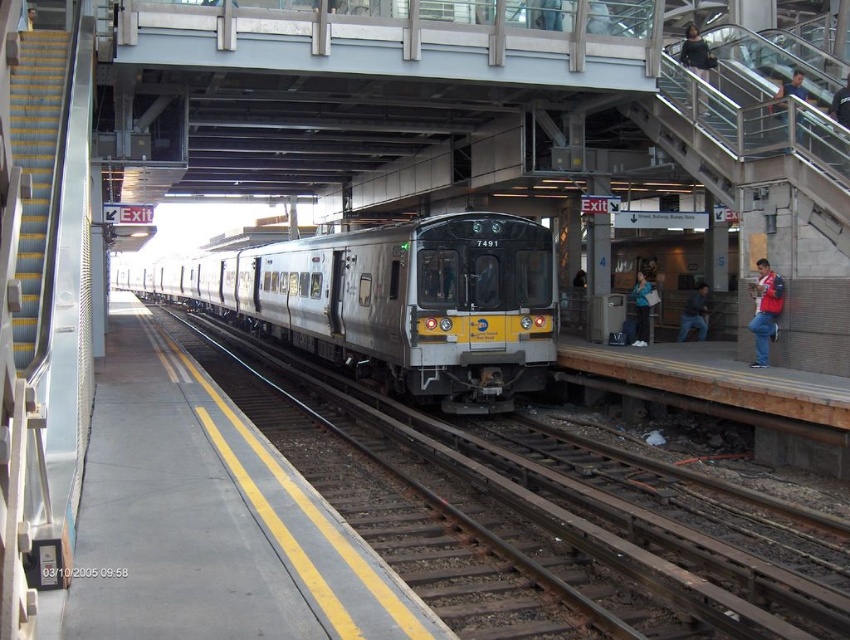
Which of these two, dark gray jacket at upper right or blue shirt at upper right, stands taller?

Standing taller between the two is dark gray jacket at upper right.

Does dark gray jacket at upper right lie in front of blue shirt at upper right?

No, dark gray jacket at upper right is further to the viewer.

Who is more distant from viewer, (688, 60) or (802, 84)?

The point (688, 60) is behind.

Locate an element on the screen. The height and width of the screenshot is (640, 850). dark gray jacket at upper right is located at coordinates (697, 52).

Does denim jacket at lower right come in front of blue shirt at upper right?

No, denim jacket at lower right is further to the viewer.

Does denim jacket at lower right have a smaller size compared to blue shirt at upper right?

No.

Does point (636, 321) lie behind point (788, 84)?

That is True.

What are the coordinates of `denim jacket at lower right` in the screenshot? It's located at (643, 305).

At what (x,y) coordinates should I click in order to perform the action: click on metal/smooth train track at center. Please return your answer as a coordinate pair (x, y). The image size is (850, 640). Looking at the image, I should click on (579, 512).